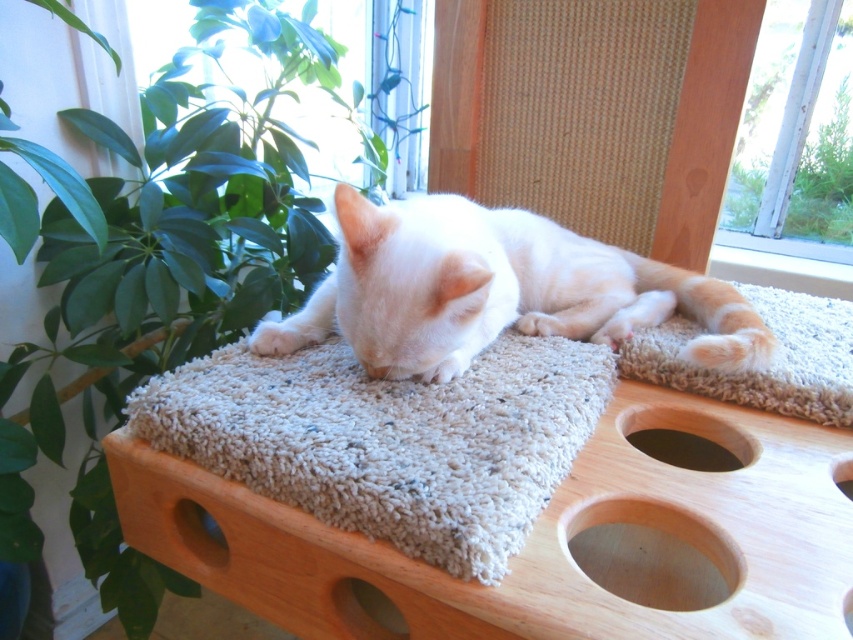
You are a cat owner who wants to place a new toy between the white fluffy cat at center and the orange striped fur at center. Based on their positions, where should you place the toy?

The white fluffy cat at center is to the left of orange striped fur at center, so you should place the toy between them, ensuring it is positioned to the right of the white fluffy cat at center and to the left of the orange striped fur at center.

You are a robotic vacuum trying to navigate from the window to the cat. There are two points marked in the image. One is at point (602, 401) and the other is at point (218, 557). Which point should you avoid to ensure you don not hit any obstacles?

Point (602, 401) is behind point (218, 557), so you should avoid going near point (602, 401) to prevent collision with obstacles in front of it.

You are a small toy mouse. You want to hide under the beige shaggy carpet at center or the smooth brown hole at lower left. Which location offers more coverage to stay hidden?

The beige shaggy carpet at center is larger in size than the smooth brown hole at lower left, so hiding under the beige shaggy carpet at center provides more coverage to stay hidden.